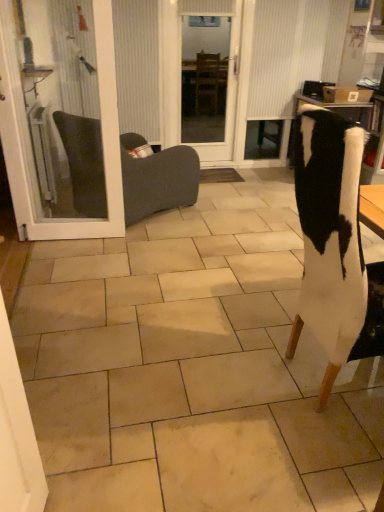
Where is `vacant area that lies between dark gray fabric chair at left, which ranks as the 2th chair in right-to-left order, and white fur chair at right, which is the second chair from back to front`? The image size is (384, 512). vacant area that lies between dark gray fabric chair at left, which ranks as the 2th chair in right-to-left order, and white fur chair at right, which is the second chair from back to front is located at coordinates (207, 274).